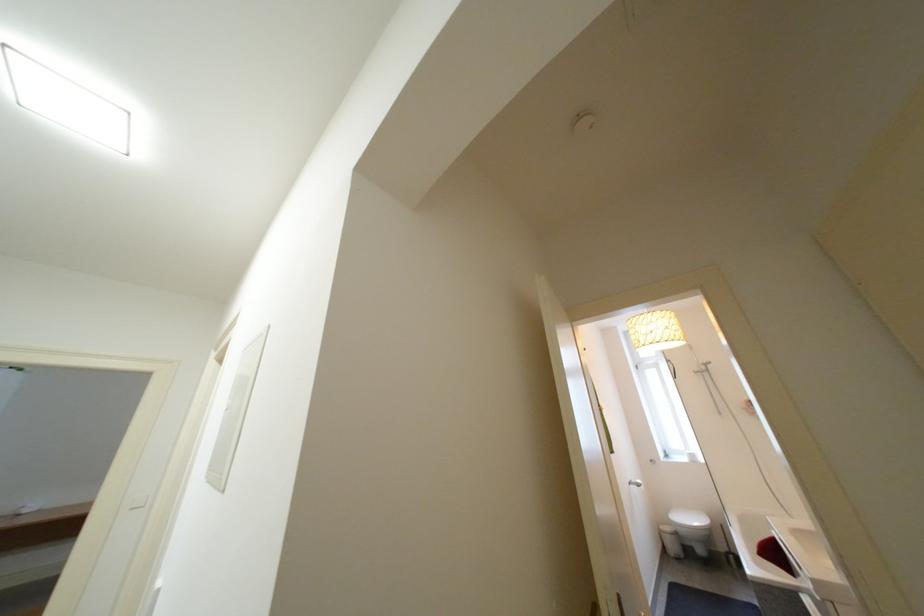
The image size is (924, 616). Find the location of `silver door handle`. silver door handle is located at coordinates (636, 484).